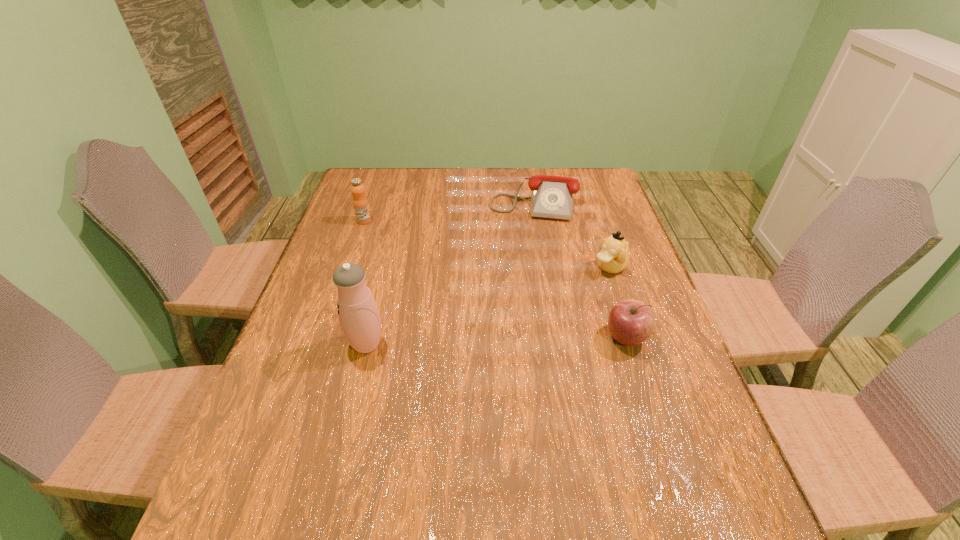
The width and height of the screenshot is (960, 540). I want to click on orange juice at the left edge, so click(360, 202).

Identify the location of apple at the right edge. The width and height of the screenshot is (960, 540). (631, 322).

The height and width of the screenshot is (540, 960). Identify the location of duckling situated at the right edge. (613, 257).

Identify the location of telephone that is at the right edge. This screenshot has width=960, height=540. (552, 197).

You are a GUI agent. You are given a task and a screenshot of the screen. Output one action in this format:
    pyautogui.click(x=<x>, y=<y>)
    Task: Click on the object located at the far right corner
    This screenshot has width=960, height=540.
    Given the screenshot: What is the action you would take?
    pyautogui.click(x=552, y=197)

At what (x,y) coordinates should I click in order to perform the action: click on free space at the far edge. Please return your answer as a coordinate pair (x, y). The image size is (960, 540). Looking at the image, I should click on (464, 172).

Where is `vacant point at the near edge`? This screenshot has width=960, height=540. vacant point at the near edge is located at coordinates (487, 474).

Where is `free space at the left edge of the desktop`? This screenshot has height=540, width=960. free space at the left edge of the desktop is located at coordinates (358, 227).

Image resolution: width=960 pixels, height=540 pixels. I want to click on free space at the right edge of the desktop, so click(x=626, y=359).

At what (x,y) coordinates should I click in order to perform the action: click on free space at the far left corner. Please return your answer as a coordinate pair (x, y). The height and width of the screenshot is (540, 960). Looking at the image, I should click on (394, 182).